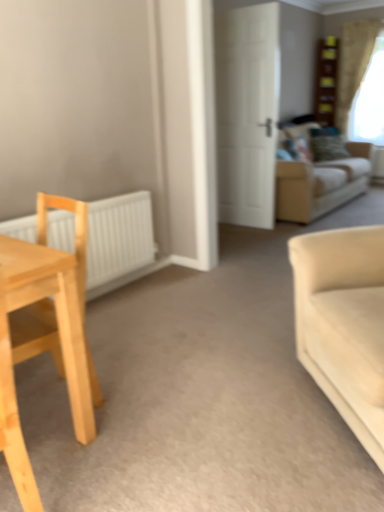
Question: From the image's perspective, is light wood chair at left below white matte radiator at left?

Choices:
 (A) no
 (B) yes

Answer: (B)

Question: Is light wood chair at left to the right of white matte radiator at left from the viewer's perspective?

Choices:
 (A) yes
 (B) no

Answer: (B)

Question: Is light wood chair at left bigger than white matte radiator at left?

Choices:
 (A) no
 (B) yes

Answer: (B)

Question: Is light wood chair at left smaller than white matte radiator at left?

Choices:
 (A) yes
 (B) no

Answer: (B)

Question: From the image's perspective, is light wood chair at left on white matte radiator at left?

Choices:
 (A) yes
 (B) no

Answer: (B)

Question: Does point (370, 297) appear closer or farther from the camera than point (289, 175)?

Choices:
 (A) closer
 (B) farther

Answer: (A)

Question: Based on their sizes in the image, would you say beige fabric couch at right, the 2th studio couch viewed from the top, is bigger or smaller than beige fabric couch at upper right, arranged as the 1th studio couch when viewed from the back?

Choices:
 (A) big
 (B) small

Answer: (B)

Question: Is beige fabric couch at right, which is counted as the second studio couch, starting from the back, taller or shorter than beige fabric couch at upper right, the first studio couch from the top?

Choices:
 (A) short
 (B) tall

Answer: (B)

Question: From a real-world perspective, relative to beige fabric couch at upper right, arranged as the 1th studio couch when viewed from the back, is beige fabric couch at right, the 2th studio couch viewed from the top, vertically above or below?

Choices:
 (A) below
 (B) above

Answer: (A)

Question: From a real-world perspective, is white matte radiator at left positioned above or below beige fabric couch at upper right, arranged as the 1th studio couch when viewed from the back?

Choices:
 (A) below
 (B) above

Answer: (A)

Question: Is white matte radiator at left inside the boundaries of beige fabric couch at upper right, the first studio couch from the top, or outside?

Choices:
 (A) outside
 (B) inside

Answer: (A)

Question: Based on their sizes in the image, would you say white matte radiator at left is bigger or smaller than beige fabric couch at upper right, arranged as the 1th studio couch when viewed from the back?

Choices:
 (A) big
 (B) small

Answer: (B)

Question: Is white matte radiator at left taller or shorter than beige fabric couch at upper right, the second studio couch viewed from the front?

Choices:
 (A) short
 (B) tall

Answer: (A)

Question: From the image's perspective, relative to beige fabric couch at upper right, arranged as the second studio couch when ordered from the bottom, is white matte door at center above or below?

Choices:
 (A) above
 (B) below

Answer: (A)

Question: In terms of width, does white matte door at center look wider or thinner when compared to beige fabric couch at upper right, the first studio couch from the top?

Choices:
 (A) thin
 (B) wide

Answer: (A)